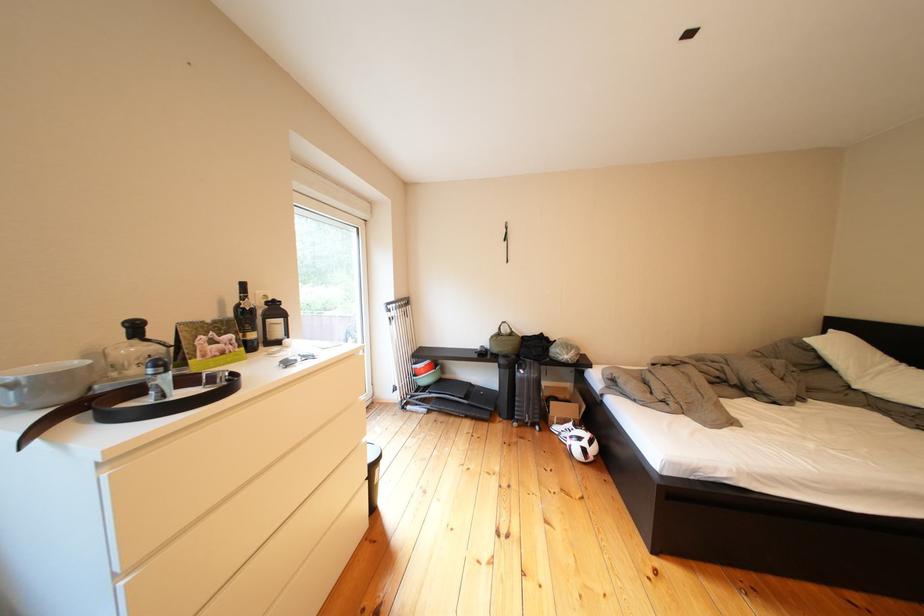
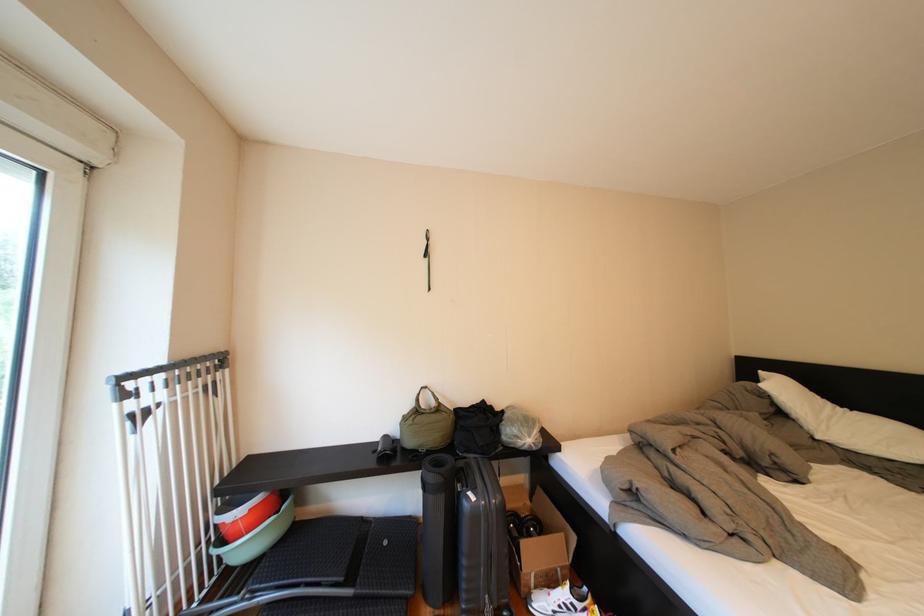
The point at (x=514, y=334) is marked in the first image. Where is the corresponding point in the second image?

(431, 405)